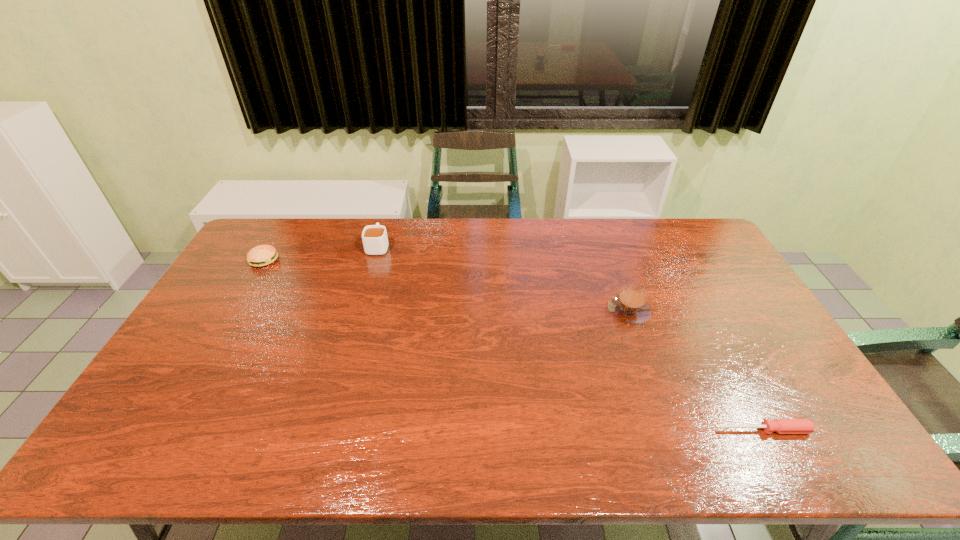
I want to click on the third object from right to left, so click(x=375, y=241).

Identify the location of cappuccino. pyautogui.click(x=629, y=306).

This screenshot has height=540, width=960. In order to click on the third farthest object in this screenshot , I will do `click(629, 306)`.

The image size is (960, 540). In order to click on patty in this screenshot , I will do `click(262, 255)`.

You are a GUI agent. You are given a task and a screenshot of the screen. Output one action in this format:
    pyautogui.click(x=<x>, y=<y>)
    Task: Click on the leftmost object
    The image size is (960, 540).
    Given the screenshot: What is the action you would take?
    pyautogui.click(x=262, y=255)

The height and width of the screenshot is (540, 960). What are the coordinates of `screwdriver` in the screenshot? It's located at (782, 426).

Where is `the rightmost object`? This screenshot has height=540, width=960. the rightmost object is located at coordinates (782, 426).

Identify the location of vacant point located on the side with the handle of the second object from left to right. (385, 221).

At what (x,y) coordinates should I click in order to perform the action: click on vacant space located on the side with the handle of the second object from left to right. Please return your answer as a coordinate pair (x, y). Looking at the image, I should click on (384, 226).

What are the coordinates of `vacant area located on the side with the handle of the second object from left to right` in the screenshot? It's located at (386, 220).